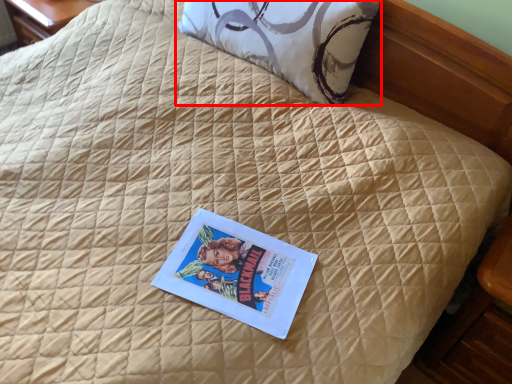
Question: From the image's perspective, what is the correct spatial positioning of pillow (annotated by the red box) in reference to paperback book?

Choices:
 (A) above
 (B) below

Answer: (A)